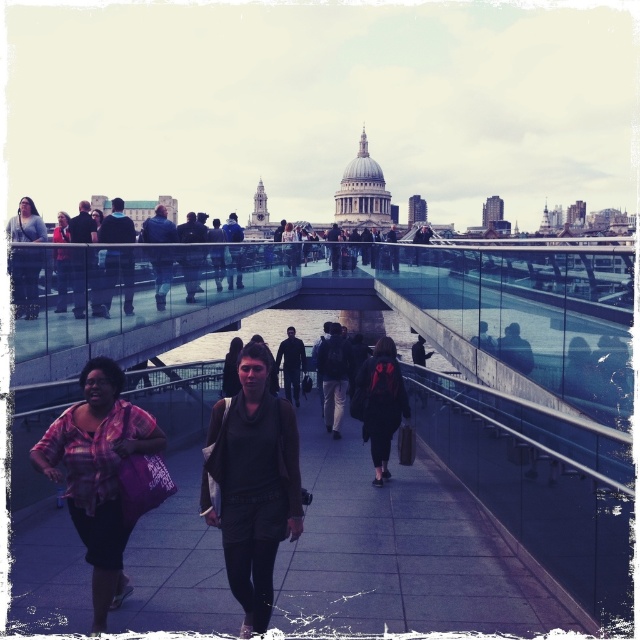
You are standing on the pedestrian bridge and want to take a photo of both the tourist holding a camera and the person with the large pink bag. Which of the two points, point 1 at coordinates point (56, 451) or point 2 at coordinates point (371, 396), should you focus on to ensure both subjects are in focus?

Point 1 at coordinates point (56, 451) is closer to the camera than point 2 at coordinates point (371, 396). To ensure both subjects are in focus, you should focus on the point that is closer to the camera, which is point 1 at coordinates point (56, 451).

You are standing on the pedestrian bridge and want to take a photo of the plaid fabric shirt at lower left and the black matte jacket at center. Which one should you focus on first to ensure both are in focus?

The plaid fabric shirt at lower left is closer to the viewer than the black matte jacket at center, so you should focus on the plaid fabric shirt at lower left first to ensure both are in focus.